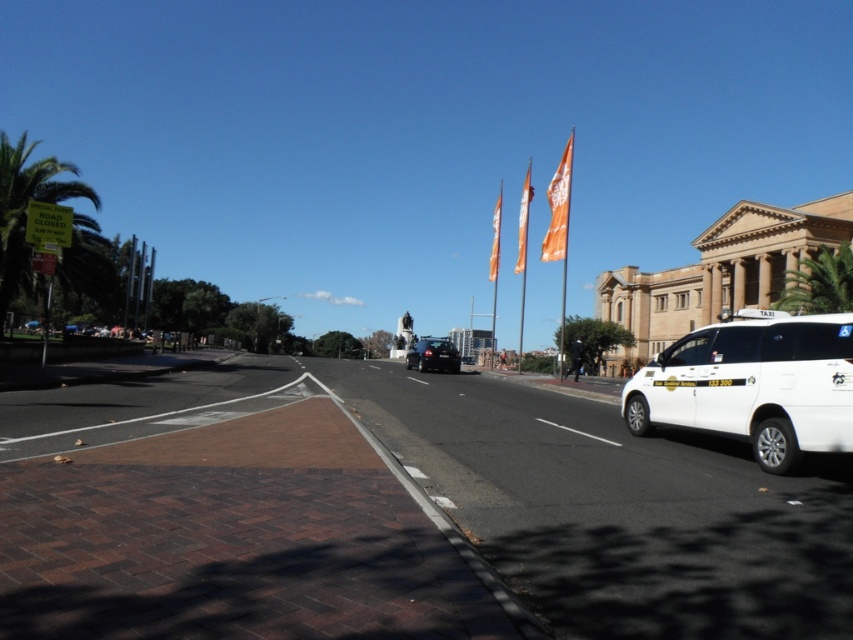
You are a city planner evaluating the street layout. You notice the green leafy palm tree at left and the orange fabric flag at upper right. Which object occupies more space in the scene?

The green leafy palm tree at left has a larger size compared to the orange fabric flag at upper right, so it occupies more space in the scene.

You are standing at the edge of the pedestrian zone looking towards the beige building. There are two points marked on the ground ahead of you at coordinates point (521, 246) and point (496, 260). Which point is closer to you?

Point (521, 246) is closer to the viewer than point (496, 260).

You are a city planner assessing the visibility of flags in a public space. You need to determine which orange fabric flag is taller between the orange fabric flag at center and the orange fabric flag at upper center. Based on the scene, which one is taller?

The orange fabric flag at center is taller than the orange fabric flag at upper center according to the description.